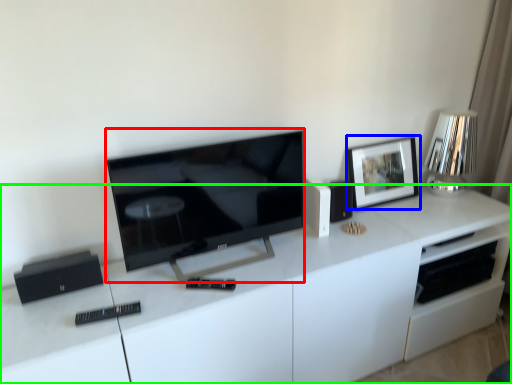
Question: Considering the real-world distances, which object is closest to television (highlighted by a red box)? picture frame (highlighted by a blue box) or cabinetry (highlighted by a green box).

Choices:
 (A) picture frame
 (B) cabinetry

Answer: (B)